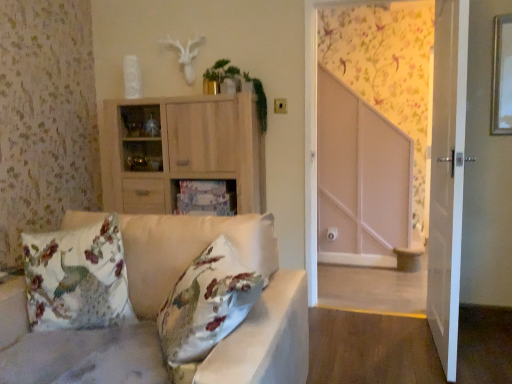
Question: From the image's perspective, is floral fabric cushion at left above satin white studio couch at left?

Choices:
 (A) yes
 (B) no

Answer: (A)

Question: Does floral fabric cushion at left appear on the left side of satin white studio couch at left?

Choices:
 (A) no
 (B) yes

Answer: (B)

Question: Considering the relative sizes of floral fabric cushion at left and satin white studio couch at left in the image provided, is floral fabric cushion at left taller than satin white studio couch at left?

Choices:
 (A) yes
 (B) no

Answer: (B)

Question: Is satin white studio couch at left at the back of floral fabric cushion at left?

Choices:
 (A) no
 (B) yes

Answer: (B)

Question: Does floral fabric cushion at left turn towards satin white studio couch at left?

Choices:
 (A) yes
 (B) no

Answer: (A)

Question: Choose the correct answer: Is floral fabric cushion at left inside light wood cabinet at center, the first cabinetry from the top, or outside it?

Choices:
 (A) inside
 (B) outside

Answer: (B)

Question: From the image's perspective, is floral fabric cushion at left located above or below light wood cabinet at center, the first cabinetry from the top?

Choices:
 (A) above
 (B) below

Answer: (B)

Question: Is floral fabric cushion at left taller or shorter than light wood cabinet at center, placed as the 2th cabinetry when sorted from bottom to top?

Choices:
 (A) tall
 (B) short

Answer: (B)

Question: Looking at their shapes, would you say floral fabric cushion at left is wider or thinner than light wood cabinet at center, placed as the 2th cabinetry when sorted from bottom to top?

Choices:
 (A) thin
 (B) wide

Answer: (A)

Question: In terms of height, does white glossy door at right look taller or shorter compared to wooden cabinet at center, positioned as the 2th cabinetry in top-to-bottom order?

Choices:
 (A) tall
 (B) short

Answer: (A)

Question: Looking at their shapes, would you say white glossy door at right is wider or thinner than wooden cabinet at center, positioned as the 2th cabinetry in top-to-bottom order?

Choices:
 (A) thin
 (B) wide

Answer: (A)

Question: Would you say white glossy door at right is to the left or to the right of wooden cabinet at center, positioned as the 2th cabinetry in top-to-bottom order, in the picture?

Choices:
 (A) left
 (B) right

Answer: (B)

Question: Based on their sizes in the image, would you say white glossy door at right is bigger or smaller than wooden cabinet at center, the first cabinetry positioned from the bottom?

Choices:
 (A) small
 (B) big

Answer: (B)

Question: From the image's perspective, is wooden cabinet at center, the first cabinetry positioned from the bottom, located above or below white glossy door at right?

Choices:
 (A) below
 (B) above

Answer: (A)

Question: From a real-world perspective, is wooden cabinet at center, positioned as the 2th cabinetry in top-to-bottom order, physically located above or below white glossy door at right?

Choices:
 (A) below
 (B) above

Answer: (A)